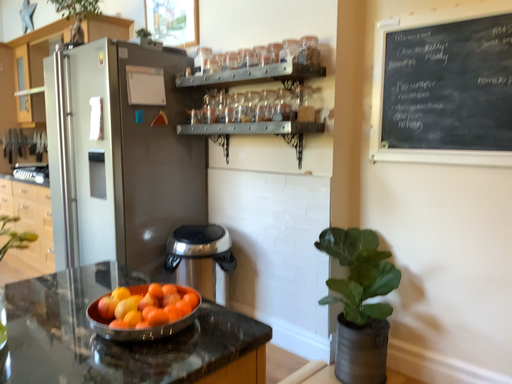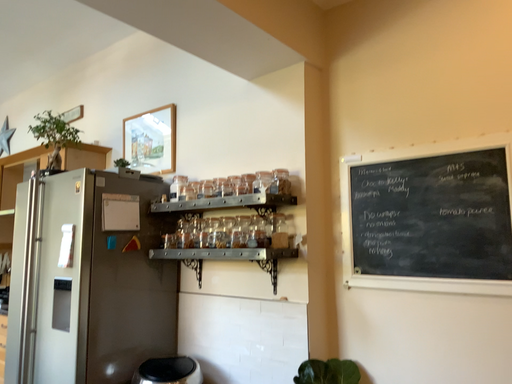
Question: Which way did the camera rotate in the video?

Choices:
 (A) rotated upward
 (B) rotated downward

Answer: (A)